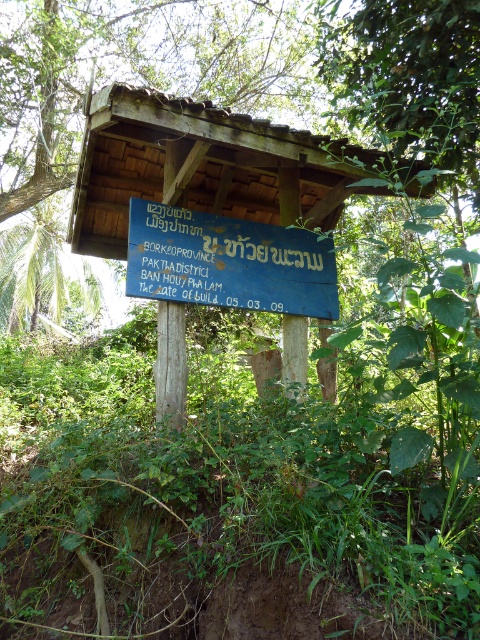
You are a traveler who wants to read the signboard. Which one is bigger between the wooden signboard at center and the blue painted wood sign at center?

The wooden signboard at center is larger than the blue painted wood sign at center.

Based on the scene description, where is the wooden signboard at center located in terms of coordinates?

The wooden signboard at center is located at coordinates point (x=200, y=164).

What is the relationship between the wooden signboard at center and the blue painted wood sign at center in terms of their position relative to the viewer?

The wooden signboard at center is closer to the viewer than the blue painted wood sign at center.